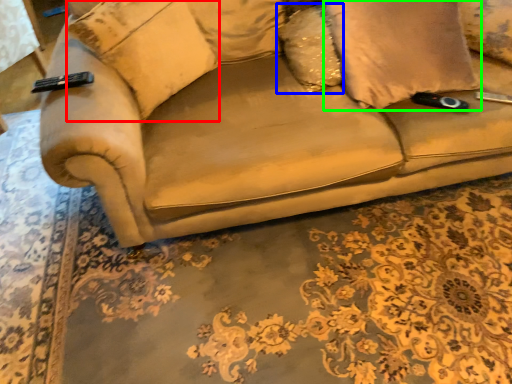
Question: Based on their relative distances, which object is nearer to pillow (highlighted by a red box)? Choose from pillow (highlighted by a blue box) and pillow (highlighted by a green box).

Choices:
 (A) pillow
 (B) pillow

Answer: (A)